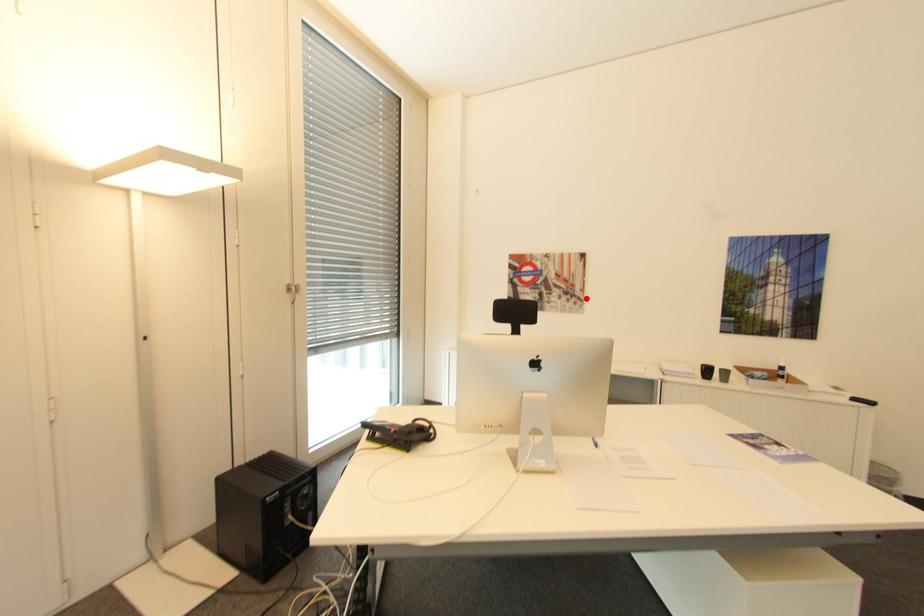
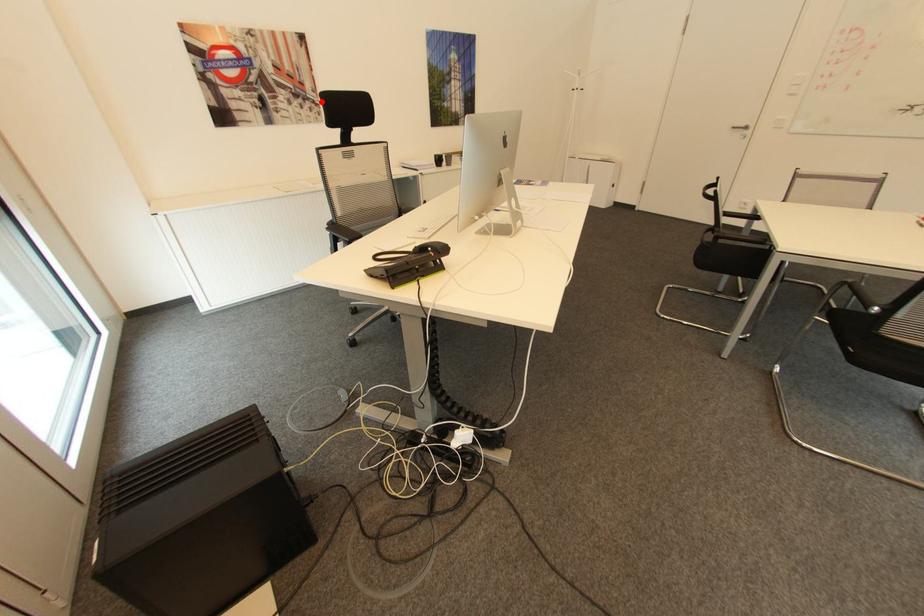
From the picture: I am providing you with two images of the same scene from different viewpoints. A red point is marked on the first image and another point is marked on the second image. Is the marked point in image1 the same physical position as the marked point in image2?

Yes